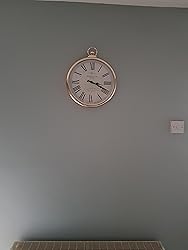
Locate an element on the screen. Image resolution: width=188 pixels, height=250 pixels. clock is located at coordinates (89, 88).